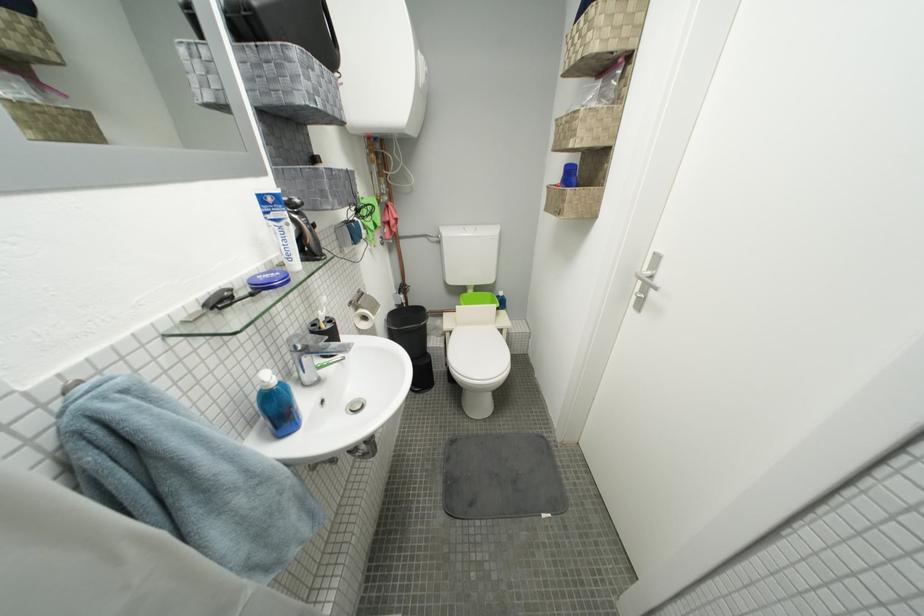
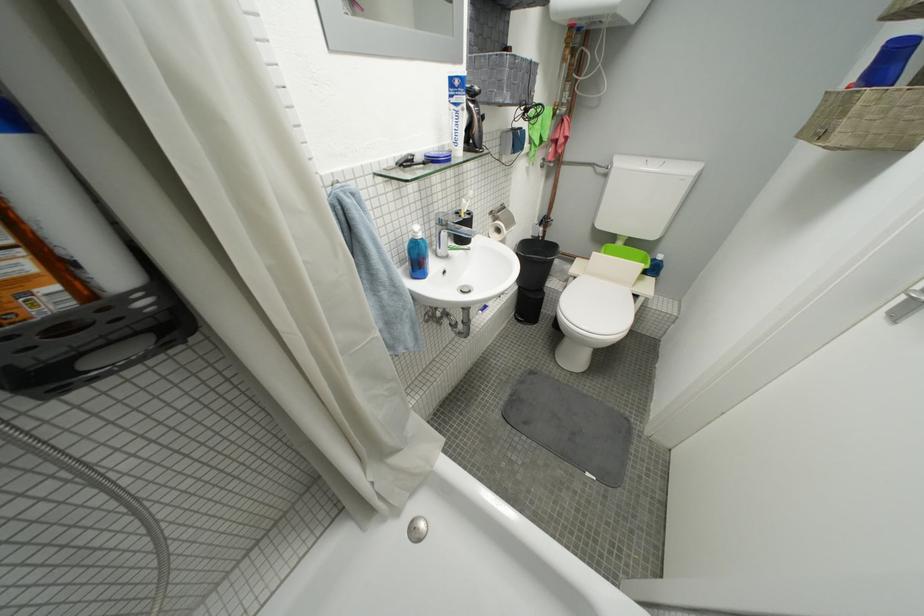
The point at (459, 334) is marked in the first image. Where is the corresponding point in the second image?

(584, 281)